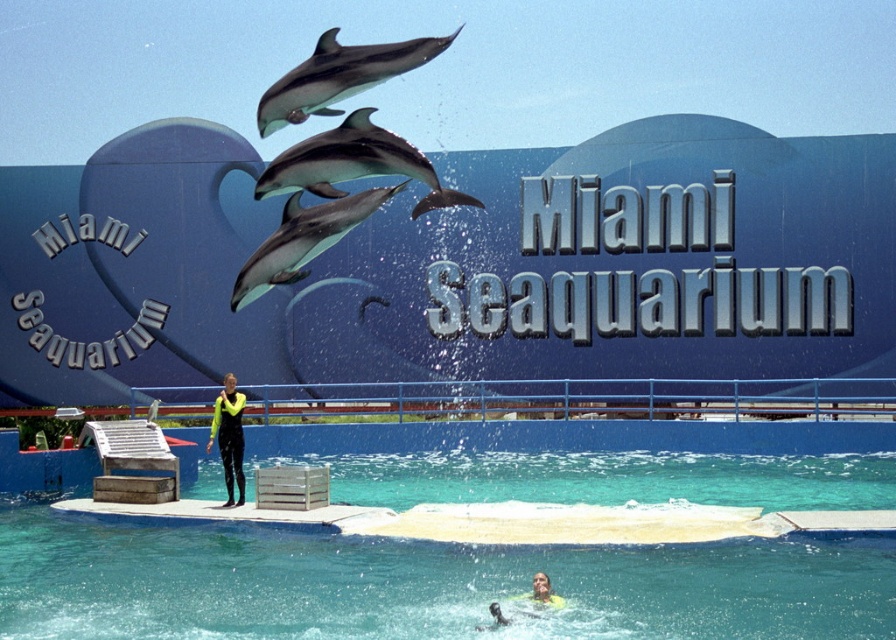
Question: Does light gray smooth dolphin at center appear on the left side of gray smooth dolphin at upper center?

Choices:
 (A) yes
 (B) no

Answer: (B)

Question: Is clear blue water at center above light gray smooth dolphin at center?

Choices:
 (A) no
 (B) yes

Answer: (A)

Question: Among these objects, which one is nearest to the camera?

Choices:
 (A) gray smooth dolphin at upper center
 (B) clear blue water at center

Answer: (A)

Question: Which point is closer to the camera?

Choices:
 (A) smooth gray dolphin at center
 (B) light gray smooth dolphin at center
 (C) neon yellow wetsuit at center
 (D) clear blue water at center

Answer: (D)

Question: Which object appears farthest from the camera in this image?

Choices:
 (A) gray smooth dolphin at upper center
 (B) smooth gray dolphin at center

Answer: (B)

Question: Is clear blue water at center thinner than gray smooth dolphin at upper center?

Choices:
 (A) yes
 (B) no

Answer: (B)